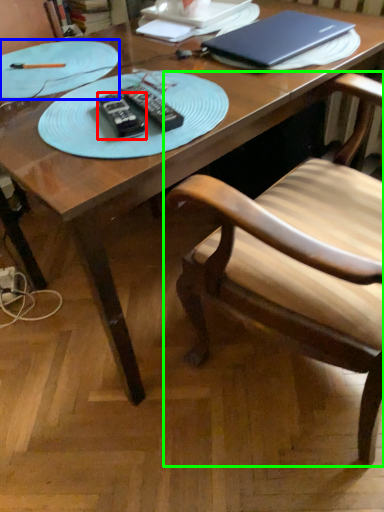
Question: Which object is positioned farthest from remote (highlighted by a red box)? Select from plate (highlighted by a blue box) and chair (highlighted by a green box).

Choices:
 (A) plate
 (B) chair

Answer: (B)